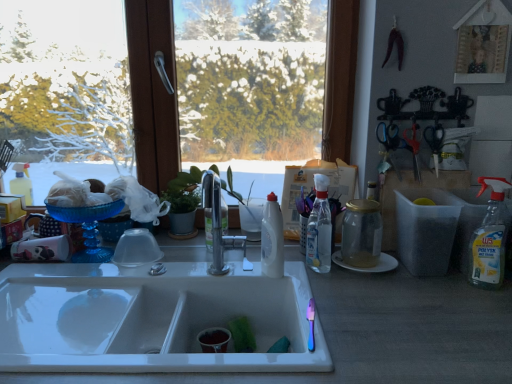
Question: Is clear glass bottle at center, the 2th bottle positioned from the left, not within blue plastic scissors at upper right, arranged as the second scissors when viewed from the right?

Choices:
 (A) yes
 (B) no

Answer: (A)

Question: Is clear glass bottle at center, marked as the first bottle in a right-to-left arrangement, looking in the opposite direction of blue plastic scissors at upper right, which appears as the first scissors when viewed from the left?

Choices:
 (A) no
 (B) yes

Answer: (B)

Question: Considering the relative sizes of clear glass bottle at center, marked as the first bottle in a right-to-left arrangement, and blue plastic scissors at upper right, arranged as the second scissors when viewed from the right, in the image provided, is clear glass bottle at center, marked as the first bottle in a right-to-left arrangement, bigger than blue plastic scissors at upper right, arranged as the second scissors when viewed from the right,?

Choices:
 (A) no
 (B) yes

Answer: (B)

Question: Is clear glass bottle at center, marked as the first bottle in a right-to-left arrangement, shorter than blue plastic scissors at upper right, which appears as the first scissors when viewed from the left?

Choices:
 (A) yes
 (B) no

Answer: (B)

Question: From a real-world perspective, is clear glass bottle at center, marked as the first bottle in a right-to-left arrangement, below blue plastic scissors at upper right, which appears as the first scissors when viewed from the left?

Choices:
 (A) no
 (B) yes

Answer: (B)

Question: Relative to clear plastic spray bottle at right, is metallic silver scissors at right, which ranks as the 2th scissors in left-to-right order, in front or behind?

Choices:
 (A) behind
 (B) front

Answer: (A)

Question: Is metallic silver scissors at right, the first scissors viewed from the right, taller or shorter than clear plastic spray bottle at right?

Choices:
 (A) tall
 (B) short

Answer: (B)

Question: Is point (415, 130) positioned closer to the camera than point (474, 233)?

Choices:
 (A) closer
 (B) farther

Answer: (B)

Question: Visually, is metallic silver scissors at right, the first scissors viewed from the right, positioned to the left or to the right of clear plastic spray bottle at right?

Choices:
 (A) right
 (B) left

Answer: (B)

Question: From a real-world perspective, relative to blue plastic scissors at upper right, which appears as the first scissors when viewed from the left, is white ceramic sink at center vertically above or below?

Choices:
 (A) above
 (B) below

Answer: (B)

Question: Considering the positions of white ceramic sink at center and blue plastic scissors at upper right, arranged as the second scissors when viewed from the right, in the image, is white ceramic sink at center bigger or smaller than blue plastic scissors at upper right, arranged as the second scissors when viewed from the right,?

Choices:
 (A) small
 (B) big

Answer: (B)

Question: In the image, is white ceramic sink at center positioned in front of or behind blue plastic scissors at upper right, which appears as the first scissors when viewed from the left?

Choices:
 (A) behind
 (B) front

Answer: (B)

Question: In the image, is white ceramic sink at center on the left side or the right side of blue plastic scissors at upper right, arranged as the second scissors when viewed from the right?

Choices:
 (A) left
 (B) right

Answer: (A)

Question: Is clear glass bottle at center, the 2th bottle positioned from the left, wider or thinner than green leafy plant at center?

Choices:
 (A) wide
 (B) thin

Answer: (B)

Question: From the image's perspective, is clear glass bottle at center, the 2th bottle positioned from the left, above or below green leafy plant at center?

Choices:
 (A) below
 (B) above

Answer: (A)